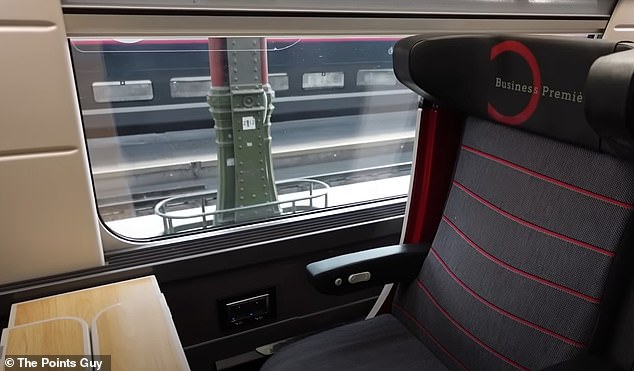
Where is `table`? This screenshot has width=634, height=371. table is located at coordinates (78, 316).